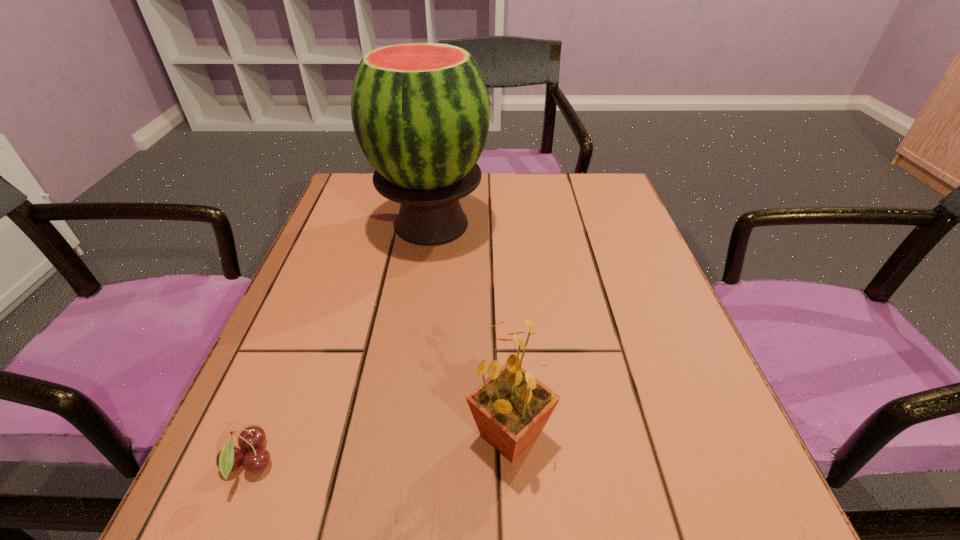
Where is `empty space between the sunflower and the leftmost object`? The height and width of the screenshot is (540, 960). empty space between the sunflower and the leftmost object is located at coordinates (380, 448).

In order to click on free spot between the farthest object and the shortest object in this screenshot , I will do `click(340, 343)`.

I want to click on vacant area that lies between the cherry and the farthest object, so click(x=340, y=343).

You are a GUI agent. You are given a task and a screenshot of the screen. Output one action in this format:
    pyautogui.click(x=<x>, y=<y>)
    Task: Click on the object that can be found as the closest to the cherry
    The height and width of the screenshot is (540, 960).
    Given the screenshot: What is the action you would take?
    pyautogui.click(x=511, y=407)

Identify which object is the nearest to the farthest object. Please provide its 2D coordinates. Your answer should be formatted as a tuple, i.e. [(x, y)], where the tuple contains the x and y coordinates of a point satisfying the conditions above.

[(511, 407)]

Locate an element on the screen. The height and width of the screenshot is (540, 960). blank space that satisfies the following two spatial constraints: 1. on the front side of the watermelon; 2. on the leaves of the cherry is located at coordinates (396, 462).